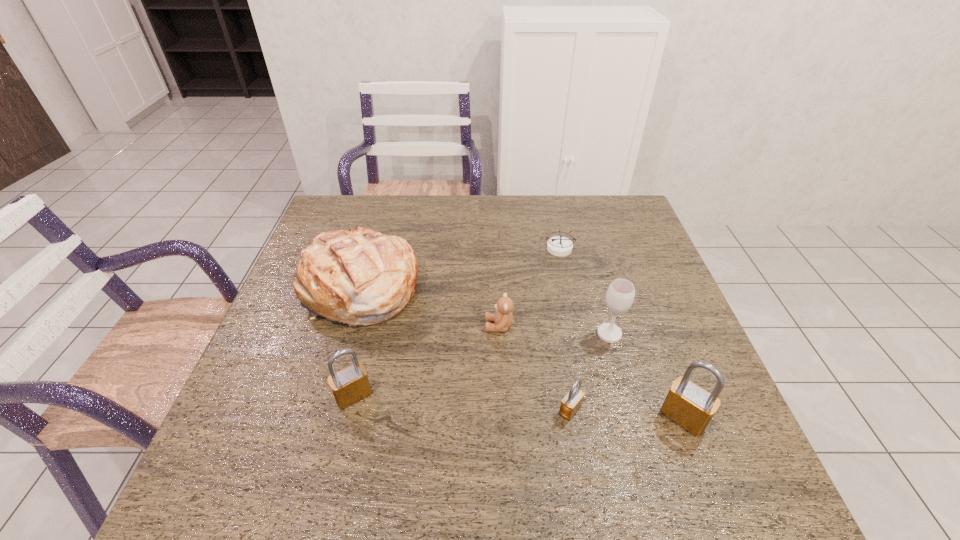
Identify the location of blank space at the near edge. (567, 422).

Where is `blank space at the right edge of the desktop`? blank space at the right edge of the desktop is located at coordinates (604, 237).

This screenshot has width=960, height=540. I want to click on vacant space at the far left corner of the desktop, so (348, 211).

You are a GUI agent. You are given a task and a screenshot of the screen. Output one action in this format:
    pyautogui.click(x=<x>, y=<y>)
    Task: Click on the free region at the near left corner of the desktop
    Image resolution: width=960 pixels, height=540 pixels.
    Given the screenshot: What is the action you would take?
    244,421

Locate an element on the screen. The width and height of the screenshot is (960, 540). free space at the far right corner is located at coordinates (599, 200).

This screenshot has height=540, width=960. In order to click on free space between the shortest padlock and the second tallest padlock in this screenshot , I will do `click(462, 403)`.

I want to click on vacant region between the bread and the teddy bear, so click(428, 308).

The width and height of the screenshot is (960, 540). Identify the location of free space between the wineglass and the rightmost object. (646, 376).

The height and width of the screenshot is (540, 960). Find the location of `free space between the teddy bear and the sixth object from left to right`. free space between the teddy bear and the sixth object from left to right is located at coordinates (554, 330).

Where is `free space between the leftmost padlock and the fifth object from right to left`? Image resolution: width=960 pixels, height=540 pixels. free space between the leftmost padlock and the fifth object from right to left is located at coordinates (426, 361).